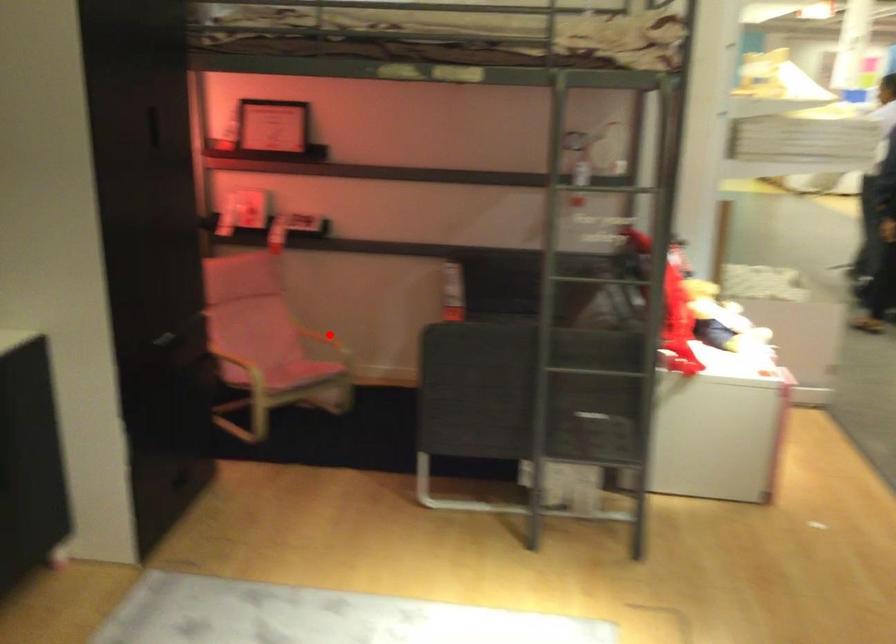
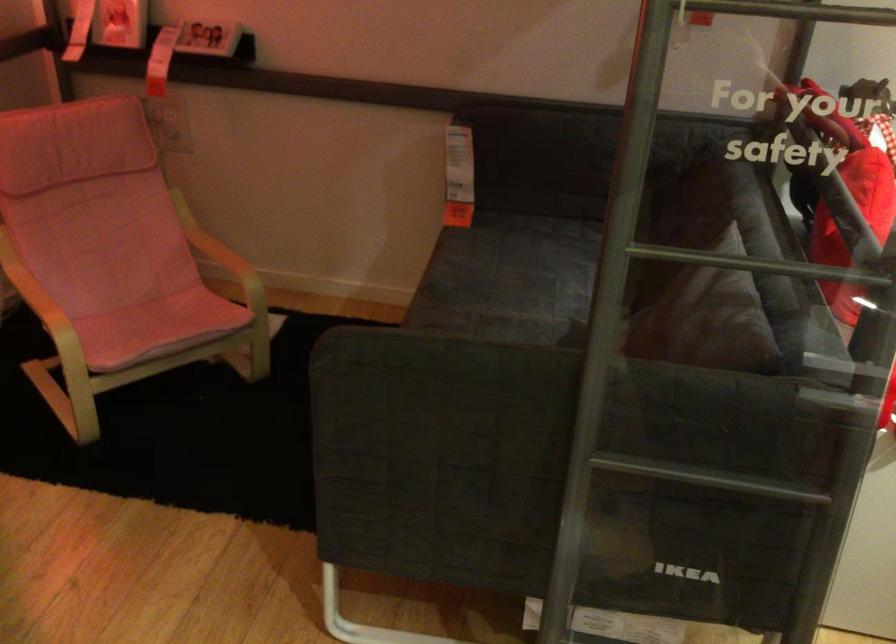
Question: I am providing you with two images of the same scene from different viewpoints. Given a red point in image1, look at the same physical point in image2. Is it:

Choices:
 (A) Closer to the viewpoint
 (B) Farther from the viewpoint

Answer: (A)